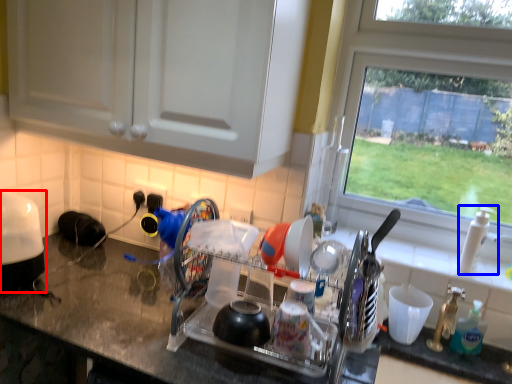
Question: Among these objects, which one is nearest to the camera, appliance (highlighted by a red box) or faucet (highlighted by a blue box)?

Choices:
 (A) appliance
 (B) faucet

Answer: (A)